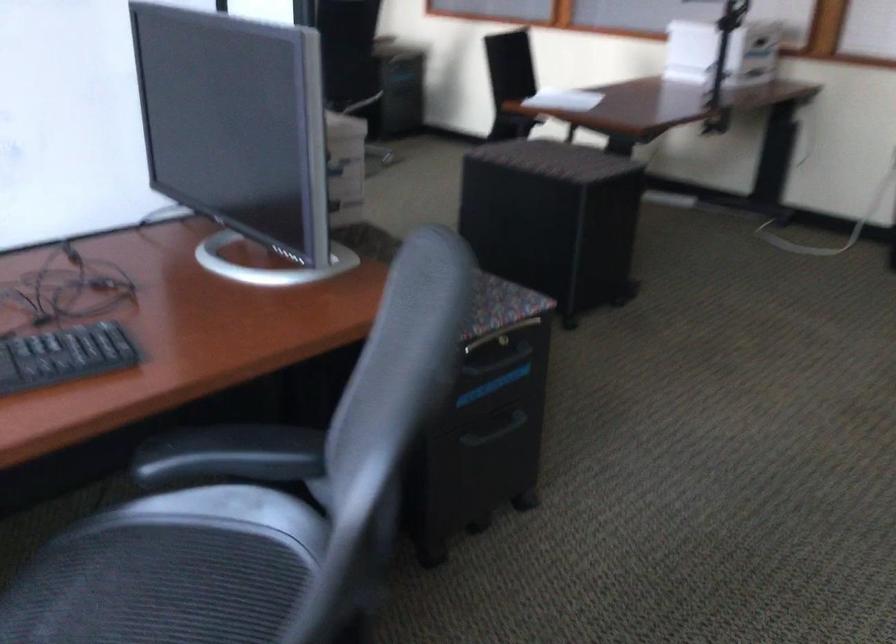
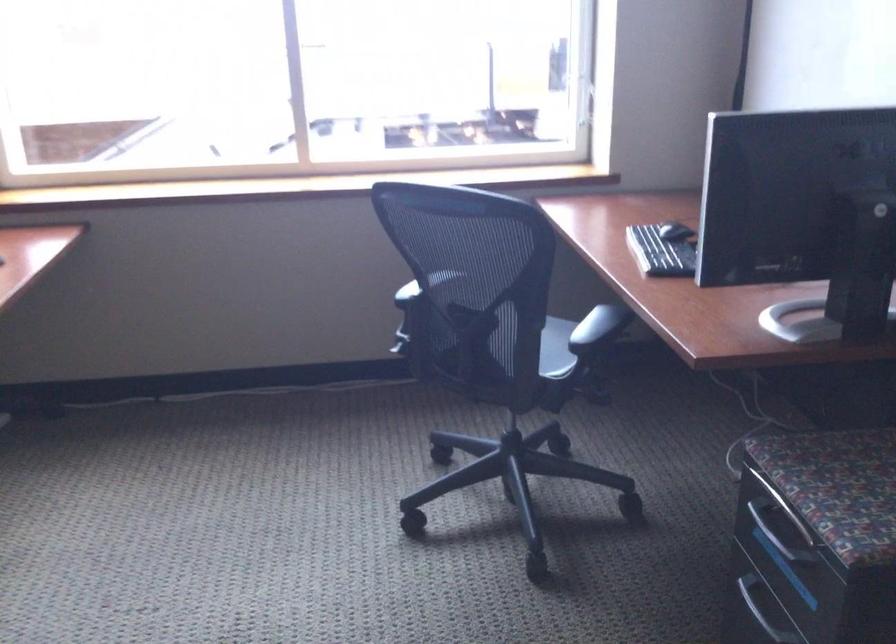
In the second image, find the point that corresponds to [507,431] in the first image.

(755, 614)